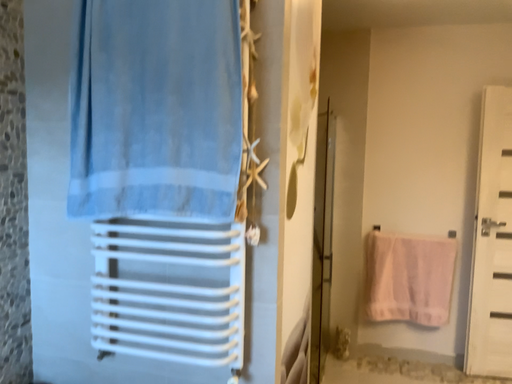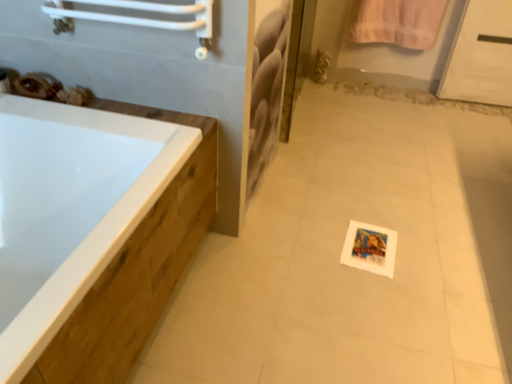
Question: How did the camera likely rotate when shooting the video?

Choices:
 (A) rotated upward
 (B) rotated downward

Answer: (B)